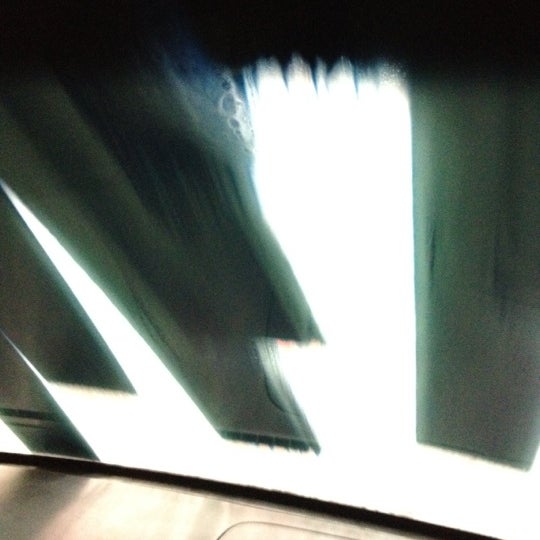
Identify the location of indent on wall. (270, 400).